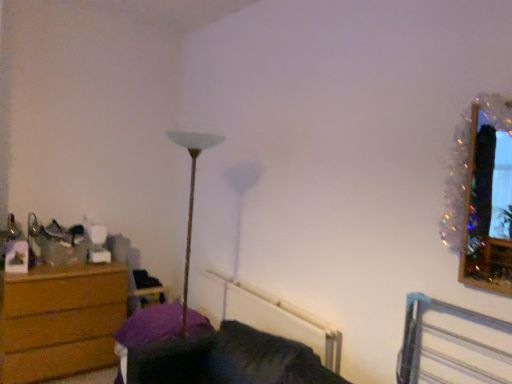
What do you see at coordinates (60, 321) in the screenshot? The height and width of the screenshot is (384, 512). I see `wooden chest of drawers at left` at bounding box center [60, 321].

What do you see at coordinates (487, 207) in the screenshot? I see `sparkly tinsel picture frame at upper right` at bounding box center [487, 207].

Locate an element on the screen. metallic silver bed frame at lower right is located at coordinates (452, 345).

What is the approximate height of velvet purple couch at lower center?

velvet purple couch at lower center is 21.73 inches in height.

Where is `wooden chest of drawers at left`? The height and width of the screenshot is (384, 512). wooden chest of drawers at left is located at coordinates (60, 321).

Is white plastic radiator at lower center touching metallic silver bed frame at lower right?

No, white plastic radiator at lower center is not making contact with metallic silver bed frame at lower right.

Looking at this image, from a real-world perspective, is white plastic radiator at lower center over metallic silver bed frame at lower right?

No.

Is white plastic radiator at lower center inside the boundaries of metallic silver bed frame at lower right, or outside?

white plastic radiator at lower center is not inside metallic silver bed frame at lower right, it's outside.

Who is taller, white plastic radiator at lower center or metallic silver bed frame at lower right?

Standing taller between the two is metallic silver bed frame at lower right.

From the image's perspective, which is below, wooden chest of drawers at left or metallic silver bed frame at lower right?

From the image's view, wooden chest of drawers at left is below.

Can you confirm if wooden chest of drawers at left is taller than metallic silver bed frame at lower right?

Yes.

The width and height of the screenshot is (512, 384). In the image, there is a wooden chest of drawers at left. In order to click on bed frame above it (from the image's perspective) in this screenshot , I will do `click(452, 345)`.

Between point (21, 357) and point (419, 326), which one is positioned behind?

Point (21, 357)

From a real-world perspective, who is located higher, wooden swivel chair at left or velvet purple couch at lower center?

In real-world perspective, wooden swivel chair at left is above.

Measure the distance from wooden swivel chair at left to velvet purple couch at lower center.

They are 4.63 feet apart.

Does point (121, 261) come behind point (130, 376)?

That is True.

From the image's perspective, is wooden swivel chair at left over velvet purple couch at lower center?

Yes, from the image's perspective, wooden swivel chair at left is over velvet purple couch at lower center.

Considering the positions of points (464, 245) and (452, 368), is point (464, 245) closer to camera compared to point (452, 368)?

Yes, point (464, 245) is in front of point (452, 368).

From a real-world perspective, who is located higher, sparkly tinsel picture frame at upper right or metallic silver bed frame at lower right?

From a 3D spatial view, sparkly tinsel picture frame at upper right is above.

Which object is closer to the camera, sparkly tinsel picture frame at upper right or metallic silver bed frame at lower right?

metallic silver bed frame at lower right is more forward.

Is sparkly tinsel picture frame at upper right inside or outside of metallic silver bed frame at lower right?

sparkly tinsel picture frame at upper right is located beyond the bounds of metallic silver bed frame at lower right.

Can we say sparkly tinsel picture frame at upper right lies outside velvet purple couch at lower center?

Yes, sparkly tinsel picture frame at upper right is not within velvet purple couch at lower center.

Measure the distance between sparkly tinsel picture frame at upper right and velvet purple couch at lower center.

sparkly tinsel picture frame at upper right and velvet purple couch at lower center are 1.12 meters apart.

You are a GUI agent. You are given a task and a screenshot of the screen. Output one action in this format:
    pyautogui.click(x=<x>, y=<y>)
    Task: Click on the picture frame above the velvet purple couch at lower center (from a real-world perspective)
    Image resolution: width=512 pixels, height=384 pixels.
    Given the screenshot: What is the action you would take?
    (x=487, y=207)

Considering the positions of objects sparkly tinsel picture frame at upper right and velvet purple couch at lower center in the image provided, who is more to the right, sparkly tinsel picture frame at upper right or velvet purple couch at lower center?

Positioned to the right is sparkly tinsel picture frame at upper right.

Considering the relative sizes of white plastic radiator at lower center and wooden swivel chair at left in the image provided, is white plastic radiator at lower center taller than wooden swivel chair at left?

No, white plastic radiator at lower center is not taller than wooden swivel chair at left.

Which of these two, white plastic radiator at lower center or wooden swivel chair at left, is bigger?

With larger size is white plastic radiator at lower center.

Which is in front, point (223, 273) or point (164, 300)?

Positioned in front is point (223, 273).

You are a GUI agent. You are given a task and a screenshot of the screen. Output one action in this format:
    pyautogui.click(x=<x>, y=<y>)
    Task: Click on the radiator located below the wooden swivel chair at left (from the image's perspective)
    
    Given the screenshot: What is the action you would take?
    pyautogui.click(x=290, y=315)

From the image's perspective, does sparkly tinsel picture frame at upper right appear lower than white plastic radiator at lower center?

No, from the image's perspective, sparkly tinsel picture frame at upper right is not beneath white plastic radiator at lower center.

How much distance is there between sparkly tinsel picture frame at upper right and white plastic radiator at lower center?

sparkly tinsel picture frame at upper right is 3.42 feet from white plastic radiator at lower center.

Is sparkly tinsel picture frame at upper right aimed at white plastic radiator at lower center?

No.

Considering the sizes of objects sparkly tinsel picture frame at upper right and white plastic radiator at lower center in the image provided, who is bigger, sparkly tinsel picture frame at upper right or white plastic radiator at lower center?

With larger size is white plastic radiator at lower center.

The height and width of the screenshot is (384, 512). Find the location of `radiator beneath the metallic silver bed frame at lower right (from a real-world perspective)`. radiator beneath the metallic silver bed frame at lower right (from a real-world perspective) is located at coordinates (290, 315).

Locate an element on the screen. The height and width of the screenshot is (384, 512). bed frame on the right of the wooden chest of drawers at left is located at coordinates (452, 345).

When comparing their distances from sparkly tinsel picture frame at upper right, does white plastic radiator at lower center or wooden chest of drawers at left seem closer?

white plastic radiator at lower center is closer to sparkly tinsel picture frame at upper right.

Considering their positions, is sparkly tinsel picture frame at upper right positioned closer to wooden chest of drawers at left than metallic silver bed frame at lower right?

metallic silver bed frame at lower right is closer to wooden chest of drawers at left.

From the image, which object appears to be nearer to wooden swivel chair at left, white plastic radiator at lower center or wooden chest of drawers at left?

Based on the image, wooden chest of drawers at left appears to be nearer to wooden swivel chair at left.

Based on their spatial positions, is metallic silver bed frame at lower right or sparkly tinsel picture frame at upper right closer to wooden chest of drawers at left?

metallic silver bed frame at lower right is closer to wooden chest of drawers at left.

Based on their spatial positions, is sparkly tinsel picture frame at upper right or velvet purple couch at lower center further from wooden swivel chair at left?

sparkly tinsel picture frame at upper right lies further to wooden swivel chair at left than the other object.

When comparing their distances from velvet purple couch at lower center, does metallic silver bed frame at lower right or sparkly tinsel picture frame at upper right seem further?

sparkly tinsel picture frame at upper right.

Estimate the real-world distances between objects in this image. Which object is closer to wooden chest of drawers at left, white plastic radiator at lower center or velvet purple couch at lower center?

Based on the image, velvet purple couch at lower center appears to be nearer to wooden chest of drawers at left.

Looking at the image, which one is located further to wooden chest of drawers at left, white plastic radiator at lower center or sparkly tinsel picture frame at upper right?

Among the two, sparkly tinsel picture frame at upper right is located further to wooden chest of drawers at left.

The image size is (512, 384). Identify the location of bed frame between white plastic radiator at lower center and sparkly tinsel picture frame at upper right from left to right. (x=452, y=345).

The image size is (512, 384). I want to click on radiator between velvet purple couch at lower center and metallic silver bed frame at lower right, so click(x=290, y=315).

The height and width of the screenshot is (384, 512). Find the location of `radiator located between velvet purple couch at lower center and wooden swivel chair at left in the depth direction`. radiator located between velvet purple couch at lower center and wooden swivel chair at left in the depth direction is located at coordinates (290, 315).

In order to click on radiator between sparkly tinsel picture frame at upper right and velvet purple couch at lower center from top to bottom in this screenshot , I will do `click(290, 315)`.